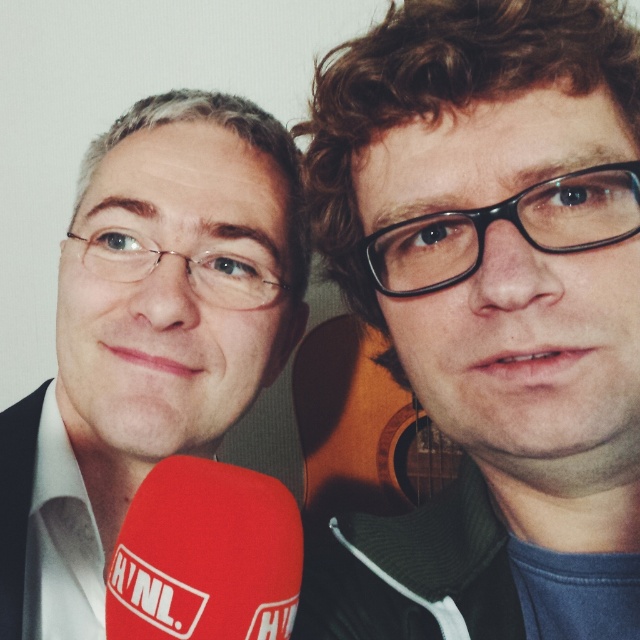
At what (x,y) coordinates should I click in order to perform the action: click on matte black suit at left. Please return your answer as a coordinate pair (x, y). Looking at the image, I should click on (147, 337).

Does point (81, 266) come in front of point (278, 564)?

No, (81, 266) is behind (278, 564).

Locate an element on the screen. This screenshot has width=640, height=640. matte black suit at left is located at coordinates (147, 337).

Identify the location of matte black glasses at center. (490, 310).

Does matte black glasses at center have a lesser width compared to red fabric microphone at lower left?

Incorrect, matte black glasses at center's width is not less than red fabric microphone at lower left's.

Locate an element on the screen. matte black glasses at center is located at coordinates (490, 310).

The height and width of the screenshot is (640, 640). I want to click on matte black glasses at center, so pyautogui.click(x=490, y=310).

Consider the image. Which is more to the right, matte black glasses at center or matte black suit at left?

matte black glasses at center is more to the right.

Is point (529, 100) closer to camera compared to point (282, 205)?

Yes, point (529, 100) is closer to viewer.

Is point (531, 252) positioned after point (68, 499)?

No, it is in front of (68, 499).

This screenshot has width=640, height=640. In order to click on matte black glasses at center in this screenshot , I will do `click(490, 310)`.